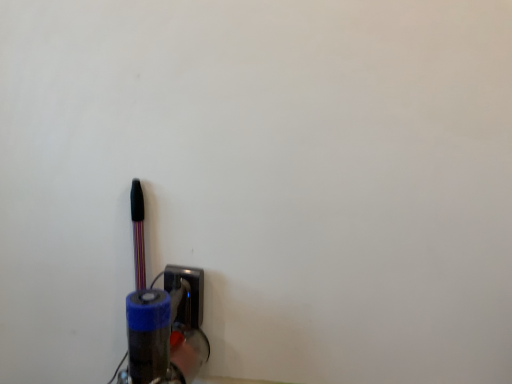
Describe the element at coordinates (190, 286) in the screenshot. Image resolution: width=512 pixels, height=384 pixels. I see `metallic socket at lower center` at that location.

Locate an element on the screen. The width and height of the screenshot is (512, 384). metallic socket at lower center is located at coordinates (190, 286).

The height and width of the screenshot is (384, 512). I want to click on metallic pen at left, so click(145, 309).

What do you see at coordinates (145, 309) in the screenshot? The width and height of the screenshot is (512, 384). I see `metallic pen at left` at bounding box center [145, 309].

From the picture: What is the approximate width of metallic pen at left?

The width of metallic pen at left is 1.95 inches.

The height and width of the screenshot is (384, 512). In order to click on metallic socket at lower center in this screenshot , I will do `click(190, 286)`.

Considering the positions of objects metallic socket at lower center and metallic pen at left in the image provided, who is more to the left, metallic socket at lower center or metallic pen at left?

From the viewer's perspective, metallic pen at left appears more on the left side.

Is metallic socket at lower center positioned in front of metallic pen at left?

That is False.

Which is in front, point (181, 271) or point (139, 218)?

Point (139, 218)

From the image's perspective, which is below, metallic socket at lower center or metallic pen at left?

metallic socket at lower center, from the image's perspective.

From a real-world perspective, is metallic socket at lower center under metallic pen at left?

Yes.

Can you confirm if metallic socket at lower center is wider than metallic pen at left?

In fact, metallic socket at lower center might be narrower than metallic pen at left.

Can you confirm if metallic socket at lower center is taller than metallic pen at left?

Incorrect, the height of metallic socket at lower center is not larger of that of metallic pen at left.

Is metallic socket at lower center bigger or smaller than metallic pen at left?

In the image, metallic socket at lower center appears to be smaller than metallic pen at left.

Is metallic socket at lower center outside of metallic pen at left?

Indeed, metallic socket at lower center is completely outside metallic pen at left.

Is metallic socket at lower center far away from metallic pen at left?

That's not correct — metallic socket at lower center is a little close to metallic pen at left.

Is metallic socket at lower center aimed at metallic pen at left?

No, metallic socket at lower center is not aimed at metallic pen at left.

How different are the orientations of metallic socket at lower center and metallic pen at left in degrees?

They differ by 1.06 degrees in their facing directions.

At what (x,y) coordinates should I click in order to perform the action: click on socket that appears on the right of metallic pen at left. Please return your answer as a coordinate pair (x, y). Image resolution: width=512 pixels, height=384 pixels. Looking at the image, I should click on (190, 286).

Is metallic pen at left to the left of metallic socket at lower center from the viewer's perspective?

Yes, metallic pen at left is to the left of metallic socket at lower center.

Is metallic pen at left positioned before metallic socket at lower center?

Yes.

Which point is more forward, (154, 366) or (165, 290)?

The point (154, 366) is in front.

From the image's perspective, which is below, metallic pen at left or metallic socket at lower center?

From the image's view, metallic socket at lower center is below.

From a real-world perspective, which object rests below the other?

metallic socket at lower center.

Looking at this image, considering the relative sizes of metallic pen at left and metallic socket at lower center in the image provided, is metallic pen at left thinner than metallic socket at lower center?

No, metallic pen at left is not thinner than metallic socket at lower center.

Is metallic pen at left taller than metallic socket at lower center?

Yes, metallic pen at left is taller than metallic socket at lower center.

Can you confirm if metallic pen at left is smaller than metallic socket at lower center?

Actually, metallic pen at left might be larger than metallic socket at lower center.

Would you say metallic socket at lower center is part of metallic pen at left's contents?

No, metallic socket at lower center is located outside of metallic pen at left.

Looking at this image, is there a large distance between metallic pen at left and metallic socket at lower center?

metallic pen at left is actually quite close to metallic socket at lower center.

Could you tell me if metallic pen at left is facing metallic socket at lower center?

No, metallic pen at left is not facing towards metallic socket at lower center.

How many degrees apart are the facing directions of metallic pen at left and metallic socket at lower center?

The facing directions of metallic pen at left and metallic socket at lower center are 1.06 degrees apart.

Find the location of `socket on the right of metallic pen at left`. socket on the right of metallic pen at left is located at coordinates (190, 286).

There is a metallic socket at lower center. Where is `penguin above it (from a real-world perspective)`? This screenshot has width=512, height=384. penguin above it (from a real-world perspective) is located at coordinates (145, 309).

Identify the location of penguin above the metallic socket at lower center (from the image's perspective). The image size is (512, 384). (145, 309).